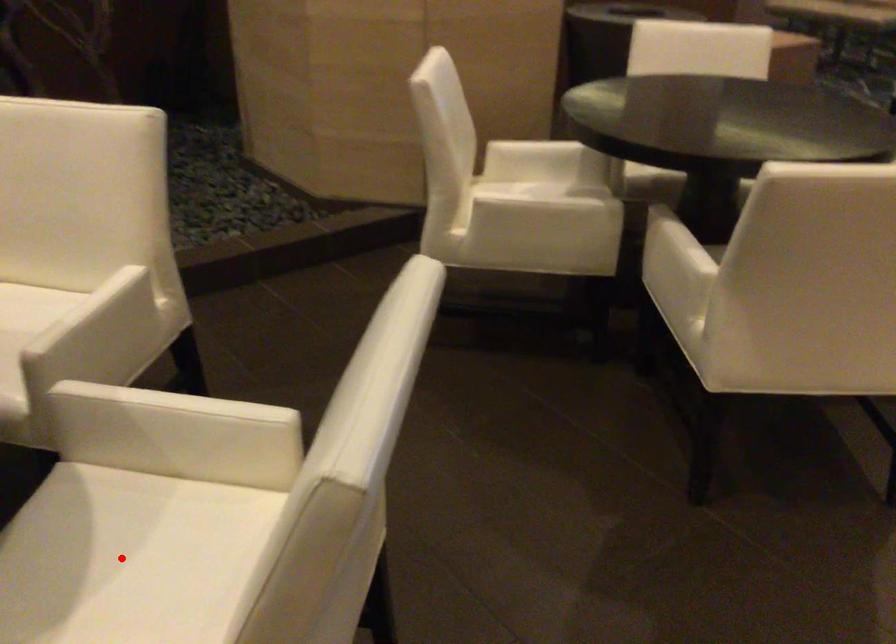
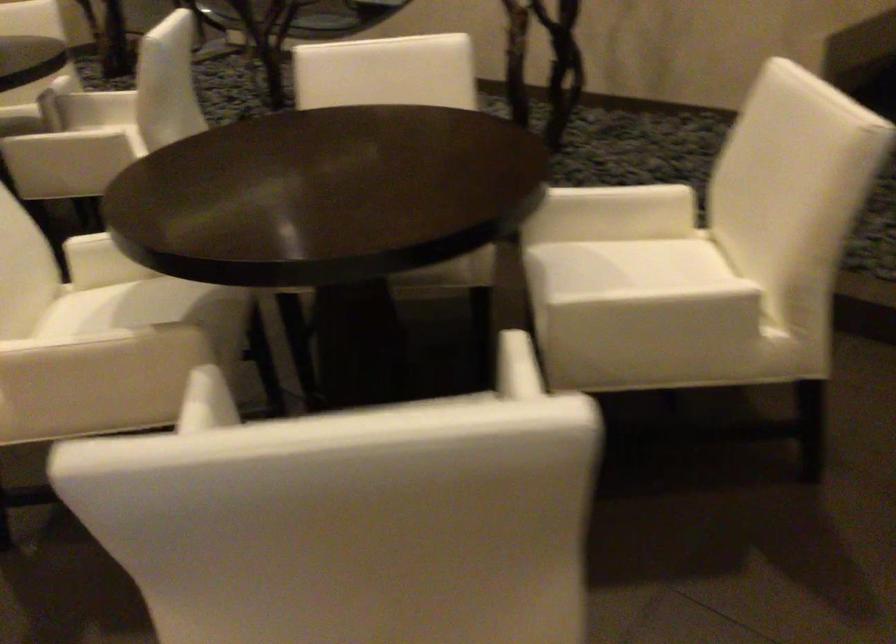
Question: I am providing you with two images of the same scene from different viewpoints. A red point is marked on the first image. At the location where the point appears in image 1, is it still visible in image 2?

Choices:
 (A) Yes
 (B) No

Answer: (B)